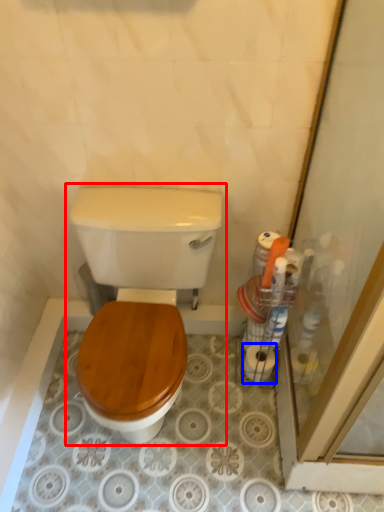
Question: Which object is further to the camera taking this photo, toilet (highlighted by a red box) or toilet paper (highlighted by a blue box)?

Choices:
 (A) toilet
 (B) toilet paper

Answer: (B)